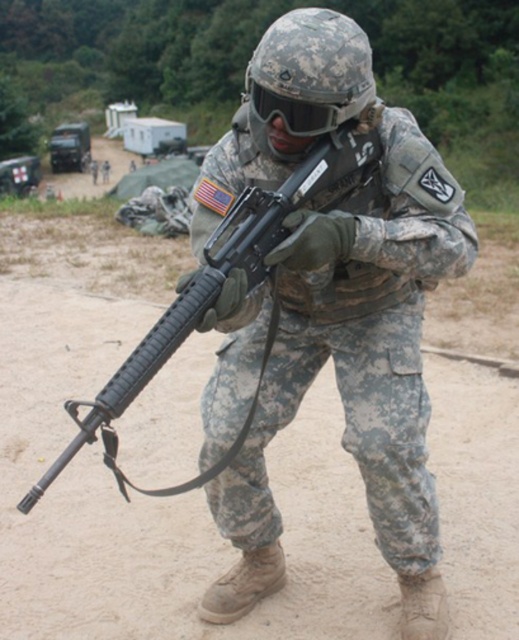
Which of these two, dirt track at center or black matte rifle at center, stands shorter?

dirt track at center is shorter.

Which is more to the left, dirt track at center or black matte rifle at center?

From the viewer's perspective, dirt track at center appears more on the left side.

Is point (28, 301) behind point (212, 300)?

Yes, it is.

In order to click on dirt track at center in this screenshot , I will do `click(141, 496)`.

Which is more to the right, camouflage uniform at center or black matte rifle at center?

Positioned to the right is camouflage uniform at center.

Can you confirm if camouflage uniform at center is wider than black matte rifle at center?

No, camouflage uniform at center is not wider than black matte rifle at center.

Find the location of a particular element. camouflage uniform at center is located at coordinates (338, 305).

Is dirt track at center smaller than camouflage uniform at center?

Correct, dirt track at center occupies less space than camouflage uniform at center.

Which is behind, point (477, 330) or point (403, 195)?

The point (477, 330) is more distant.

This screenshot has width=519, height=640. What are the coordinates of `dirt track at center` in the screenshot? It's located at (141, 496).